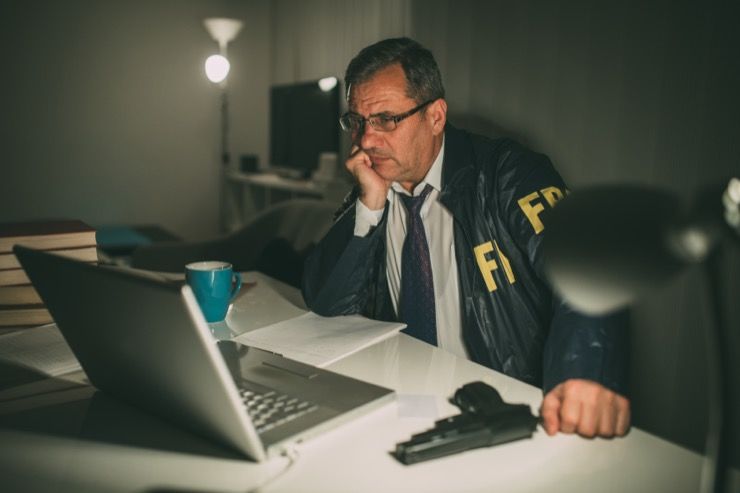
Identify the location of keyboard on laptop. (246, 400).